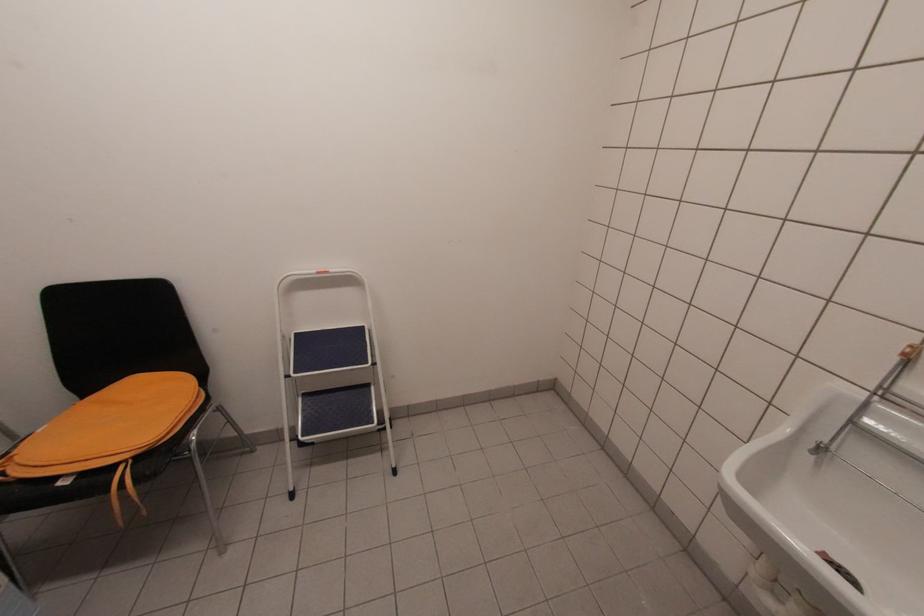
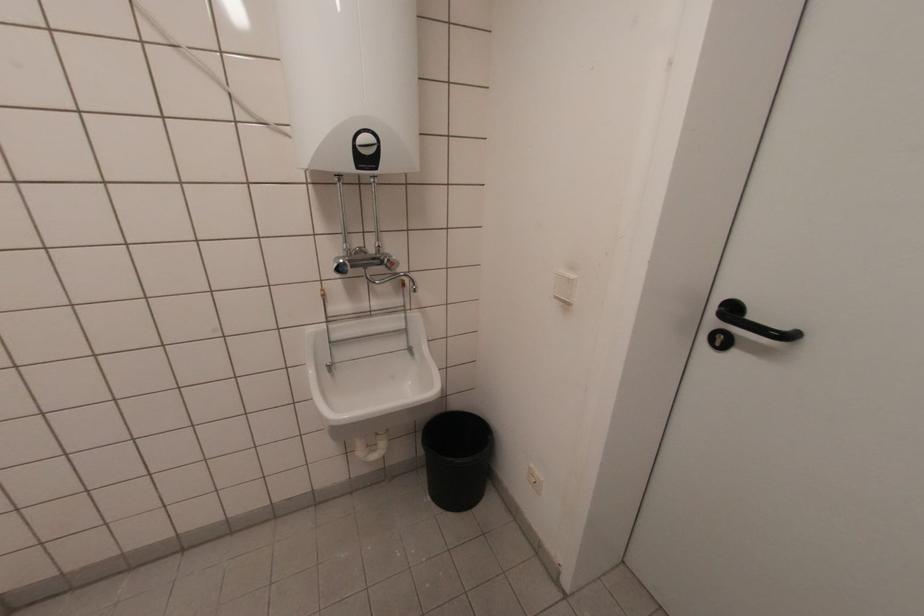
Based on the photo, first-person continuous shooting, in which direction is the camera rotating?

The rotation direction of the camera is right-down.